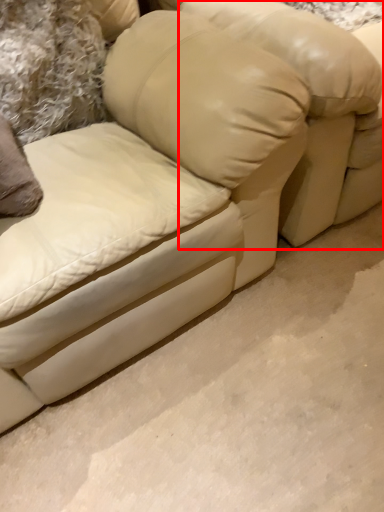
Question: Observing the image, what is the correct spatial positioning of bean bag chair (annotated by the red box) in reference to pillow?

Choices:
 (A) right
 (B) left

Answer: (A)